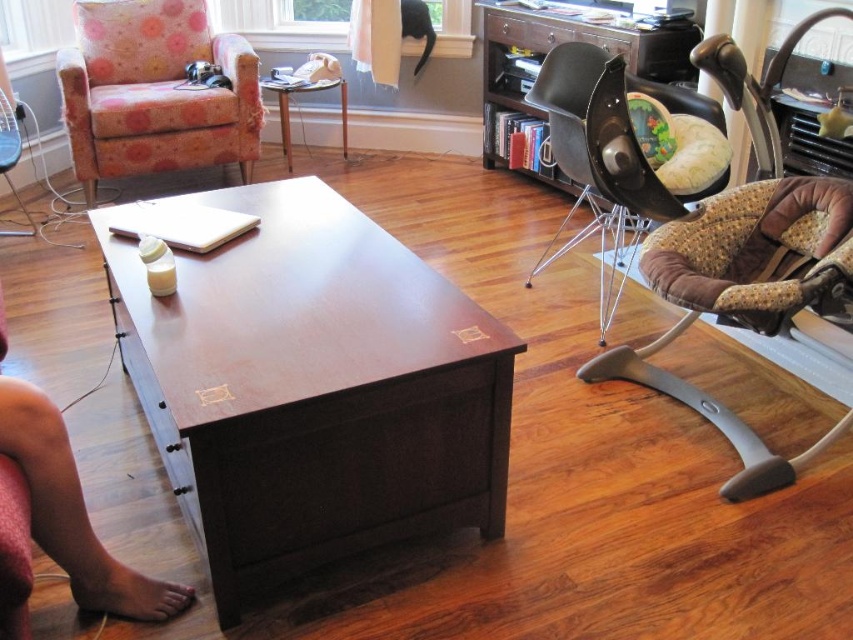
You are a delivery person who needs to place a large package on the floor between the dark brown wood table at center and the floral fabric swivel chair at left. The package is 1.5 meters long. Is there enough space between them to place the package horizontally?

The dark brown wood table at center is 1.85 meters from the floral fabric swivel chair at left. Since the package is 1.5 meters long, which is shorter than the 1.85 meters distance between the two objects, there is enough space to place the package horizontally between them.

You are sitting in the floral fabric swivel chair at left and want to reach the wooden table at center to grab a book. Which direction should you move to reach the table?

You should move to the right because the floral fabric swivel chair at left is positioned to the left of the wooden table at center, so moving right will bring you closer to the table.